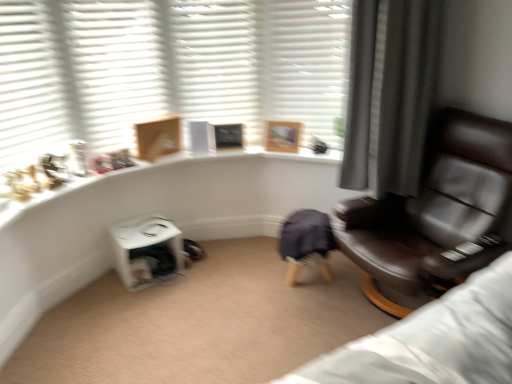
Question: Is white matte shutter at upper left, the second shutter when ordered from left to right, smaller than white matte shutters at upper left, positioned as the first shutter in left-to-right order?

Choices:
 (A) no
 (B) yes

Answer: (A)

Question: Would you say white matte shutter at upper left, the second shutter when ordered from left to right, contains white matte shutters at upper left, positioned as the first shutter in left-to-right order?

Choices:
 (A) no
 (B) yes

Answer: (A)

Question: Does white matte shutter at upper left, marked as the third shutter in a right-to-left arrangement, have a greater height compared to white matte shutters at upper left, the fourth shutter from the right?

Choices:
 (A) no
 (B) yes

Answer: (A)

Question: From a real-world perspective, does white matte shutter at upper left, the second shutter when ordered from left to right, sit lower than white matte shutters at upper left, the fourth shutter from the right?

Choices:
 (A) yes
 (B) no

Answer: (A)

Question: From a real-world perspective, is white matte shutter at upper left, the second shutter when ordered from left to right, on white matte shutters at upper left, the fourth shutter from the right?

Choices:
 (A) no
 (B) yes

Answer: (A)

Question: Can you confirm if white matte shutter at upper left, marked as the third shutter in a right-to-left arrangement, is positioned to the right of white matte shutters at upper left, positioned as the first shutter in left-to-right order?

Choices:
 (A) no
 (B) yes

Answer: (B)

Question: Does white matte shutter at upper left, marked as the third shutter in a right-to-left arrangement, have a smaller size compared to white matte shutter at upper center, the second shutter from the right?

Choices:
 (A) no
 (B) yes

Answer: (B)

Question: Does white matte shutter at upper left, marked as the third shutter in a right-to-left arrangement, turn towards white matte shutter at upper center, marked as the third shutter in a left-to-right arrangement?

Choices:
 (A) no
 (B) yes

Answer: (A)

Question: From a real-world perspective, is white matte shutter at upper left, marked as the third shutter in a right-to-left arrangement, physically above white matte shutter at upper center, the second shutter from the right?

Choices:
 (A) yes
 (B) no

Answer: (A)

Question: Is white matte shutter at upper left, the second shutter when ordered from left to right, not within white matte shutter at upper center, the second shutter from the right?

Choices:
 (A) no
 (B) yes

Answer: (B)

Question: Is white matte shutter at upper left, the second shutter when ordered from left to right, thinner than white matte shutter at upper center, the second shutter from the right?

Choices:
 (A) no
 (B) yes

Answer: (A)

Question: Does white matte shutter at upper left, marked as the third shutter in a right-to-left arrangement, have a greater height compared to white matte shutter at upper center, marked as the third shutter in a left-to-right arrangement?

Choices:
 (A) yes
 (B) no

Answer: (A)

Question: Does white matte shutter at upper center, marked as the third shutter in a left-to-right arrangement, have a greater height compared to white matte shutter at upper center, arranged as the first shutter when viewed from the right?

Choices:
 (A) yes
 (B) no

Answer: (A)